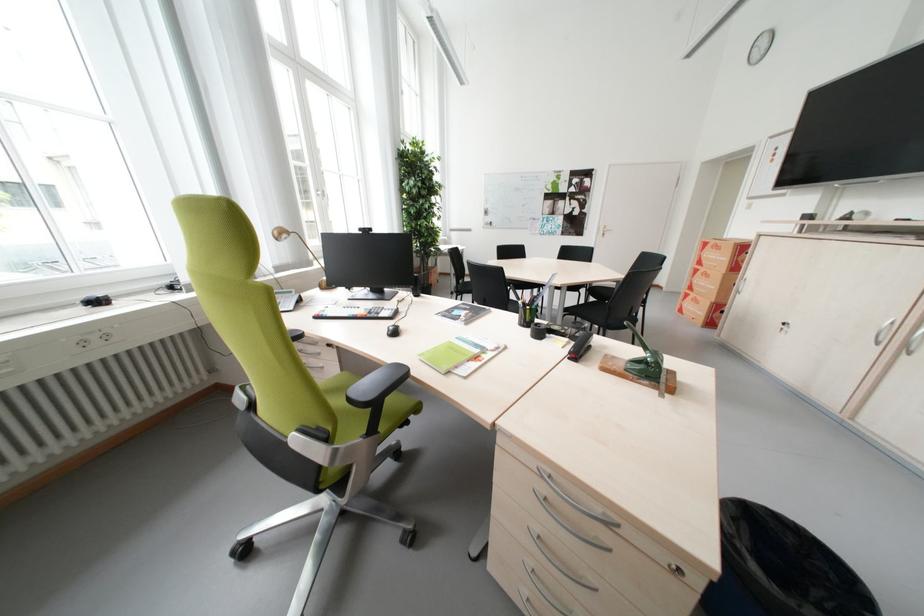
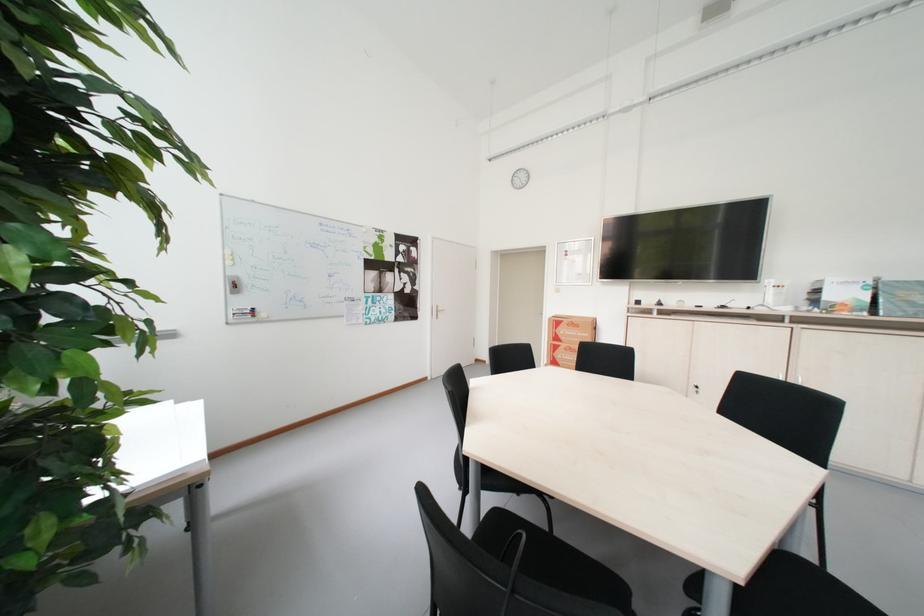
Find the pixel in the second image that matches [712,270] in the first image.

(573, 347)